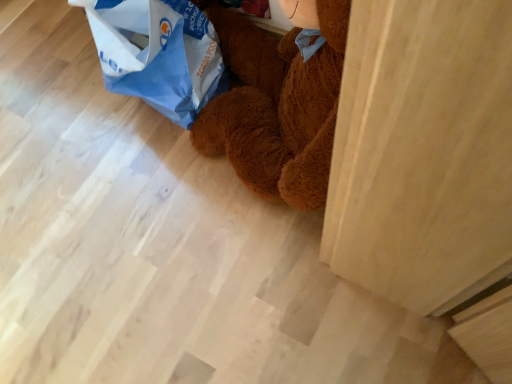
Identify the location of blue paper bag at upper left. (157, 53).

In order to face blue paper bag at upper left, should I rotate leftwards or rightwards?

To face it directly, rotate left by 16.360 degrees.

Describe the element at coordinates (157, 53) in the screenshot. I see `blue paper bag at upper left` at that location.

Consider the image. Measure the distance between blue paper bag at upper left and camera.

The depth of blue paper bag at upper left is 30.45 inches.

Where is `blue paper bag at upper left`? The image size is (512, 384). blue paper bag at upper left is located at coordinates (157, 53).